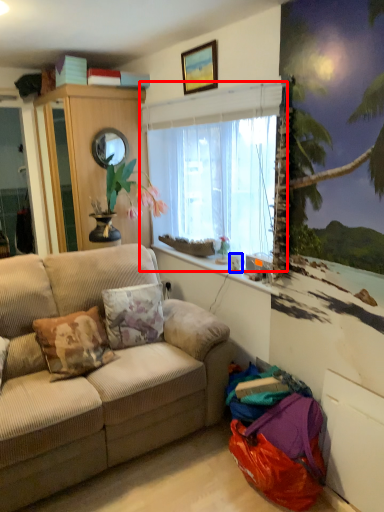
Question: Among these objects, which one is farthest to the camera, window (highlighted by a red box) or coffee cup (highlighted by a blue box)?

Choices:
 (A) window
 (B) coffee cup

Answer: (B)